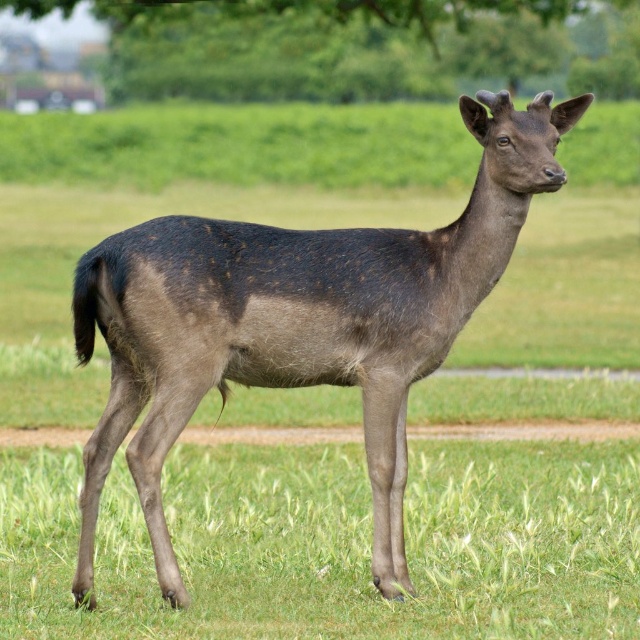
Is brown fur deer at center shorter than green leafy tree at upper center?

No.

Consider the image. Does brown fur deer at center appear over green leafy tree at upper center?

No.

The width and height of the screenshot is (640, 640). In order to click on brown fur deer at center in this screenshot , I will do coord(298,321).